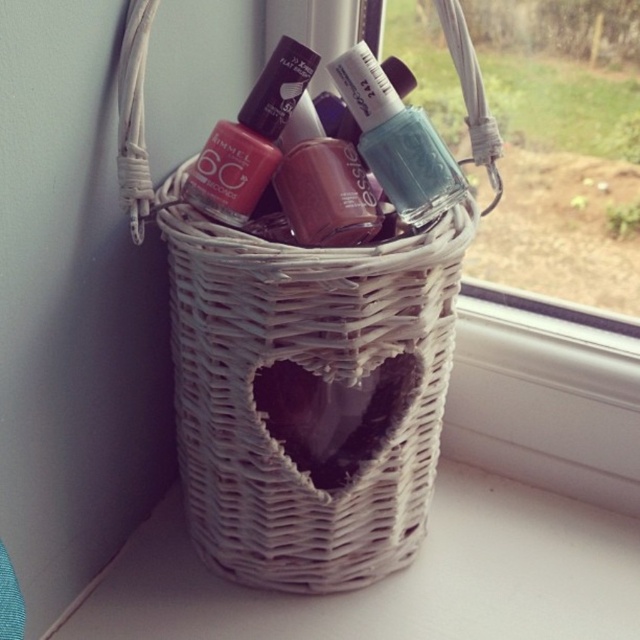
You are organizing nail polish bottles in the wicker basket on the windowsill. You notice the matte plastic nail polish at center and the matte burgundy nail polish at center. Which one is placed on top of the other?

The matte plastic nail polish at center is positioned over the matte burgundy nail polish at center, so it is placed on top.

You are organizing a beauty supply store and need to stack the teal glossy nail polish at center and the matte plastic nail polish at center on a shelf. Which one should you place on top to ensure stability?

The teal glossy nail polish at center has a lesser height compared to matte plastic nail polish at center, so placing the shorter teal glossy nail polish at center on top of the taller matte plastic nail polish at center would provide better stability.

You are organizing a makeup kit and need to place the matte plastic nail polish at center and the matte burgundy nail polish at center into a compartment. Which one should you place first to ensure proper stacking?

You should place the matte plastic nail polish at center first because it is closer to the viewer, meaning it is positioned in front of the matte burgundy nail polish at center. By placing the front item first, you can stack the matte burgundy nail polish at center behind it effectively.